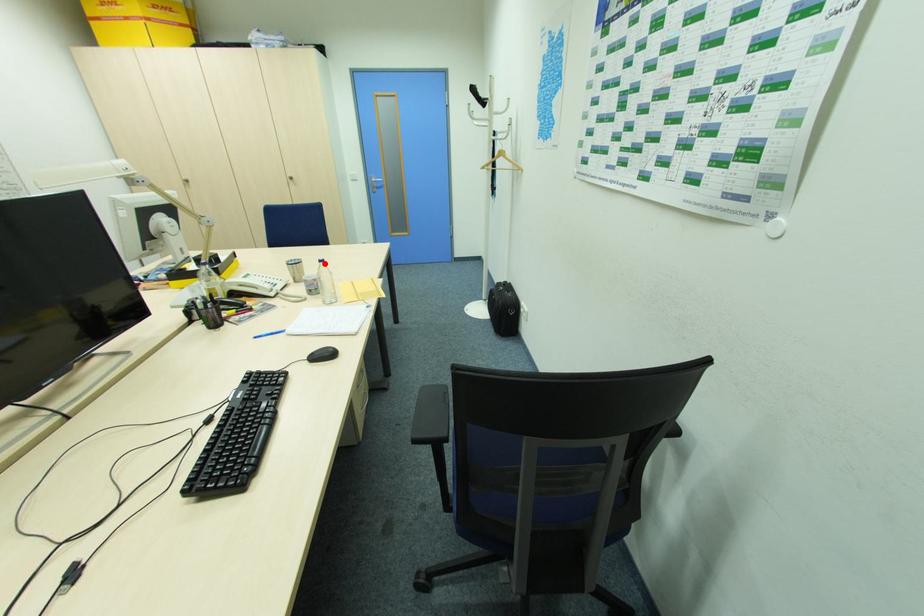
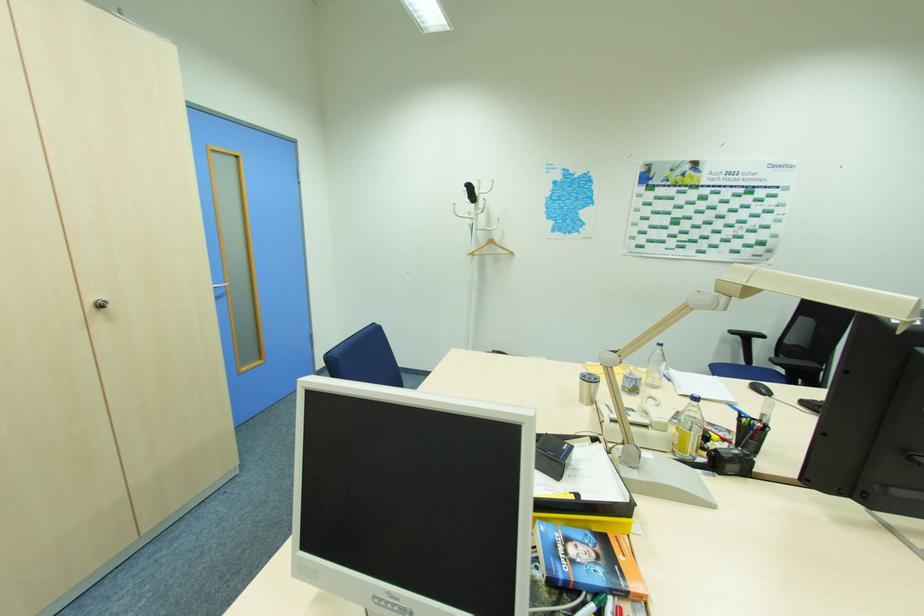
Question: I am providing you with two images of the same scene from different viewpoints. Image1 has a red point marked. In image2, the corresponding 3D location appears at what relative position? Reply with the corresponding letter.

Choices:
 (A) Closer
 (B) Farther

Answer: (B)